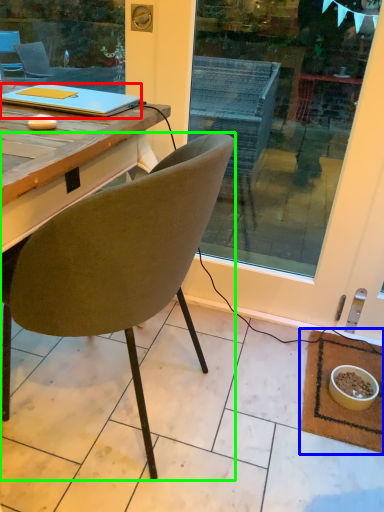
Question: Which is farther away from laptop (highlighted by a red box)? mat (highlighted by a blue box) or chair (highlighted by a green box)?

Choices:
 (A) mat
 (B) chair

Answer: (A)